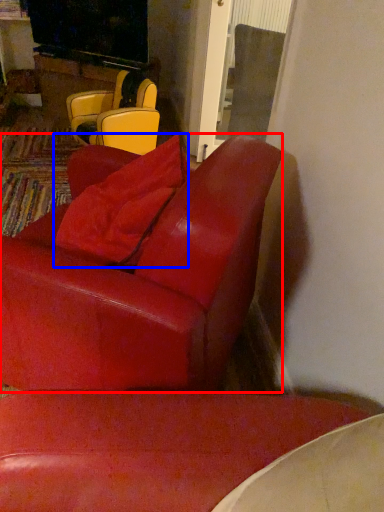
Question: Which object is closer to the camera taking this photo, chair (highlighted by a red box) or pillow (highlighted by a blue box)?

Choices:
 (A) chair
 (B) pillow

Answer: (A)